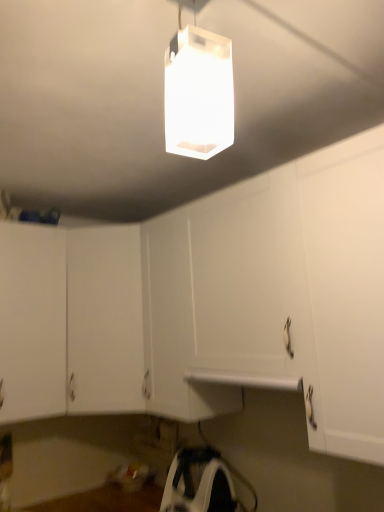
What do you see at coordinates (201, 483) in the screenshot? I see `white plastic iron at lower center` at bounding box center [201, 483].

What is the approximate width of white matte cabinet at lower left, the 2th cabinetry positioned from the right?

white matte cabinet at lower left, the 2th cabinetry positioned from the right, is 15.60 inches in width.

In order to face transparent plastic lamp at upper center, should I rotate leftwards or rightwards?

Rotate your view right by about 0.260°.

Describe the element at coordinates (198, 91) in the screenshot. I see `transparent plastic lamp at upper center` at that location.

This screenshot has width=384, height=512. What are the coordinates of `white plastic iron at lower center` in the screenshot? It's located at (201, 483).

How distant is white matte cabinet at center, which appears as the second cabinetry when viewed from the left, from white plastic iron at lower center?

A distance of 23.90 inches exists between white matte cabinet at center, which appears as the second cabinetry when viewed from the left, and white plastic iron at lower center.

Is white matte cabinet at center, which is the 1th cabinetry from right to left, not near white plastic iron at lower center?

No, white matte cabinet at center, which is the 1th cabinetry from right to left, is in close proximity to white plastic iron at lower center.

Can you confirm if white matte cabinet at center, which is the 1th cabinetry from right to left, is positioned to the right of white plastic iron at lower center?

Incorrect, white matte cabinet at center, which is the 1th cabinetry from right to left, is not on the right side of white plastic iron at lower center.

Does white matte cabinet at center, which appears as the second cabinetry when viewed from the left, have a greater width compared to white plastic iron at lower center?

Correct, the width of white matte cabinet at center, which appears as the second cabinetry when viewed from the left, exceeds that of white plastic iron at lower center.

Can you confirm if white matte cabinet at lower left, the 2th cabinetry positioned from the right, is shorter than white plastic iron at lower center?

In fact, white matte cabinet at lower left, the 2th cabinetry positioned from the right, may be taller than white plastic iron at lower center.

From the image's perspective, between white matte cabinet at lower left, the 1th cabinetry viewed from the left, and white plastic iron at lower center, who is located below?

white plastic iron at lower center appears lower in the image.

Which object is wider, white matte cabinet at lower left, the 1th cabinetry viewed from the left, or white plastic iron at lower center?

white matte cabinet at lower left, the 1th cabinetry viewed from the left.

Does white matte cabinet at lower left, the 1th cabinetry viewed from the left, turn towards white plastic iron at lower center?

No, white matte cabinet at lower left, the 1th cabinetry viewed from the left, is not turned towards white plastic iron at lower center.

From the image's perspective, which object appears higher, white matte cabinet at lower left, the 2th cabinetry positioned from the right, or white matte cabinet at center, which appears as the second cabinetry when viewed from the left?

white matte cabinet at lower left, the 2th cabinetry positioned from the right, from the image's perspective.

Considering the sizes of white matte cabinet at lower left, the 1th cabinetry viewed from the left, and white matte cabinet at center, which appears as the second cabinetry when viewed from the left, in the image, is white matte cabinet at lower left, the 1th cabinetry viewed from the left, bigger or smaller than white matte cabinet at center, which appears as the second cabinetry when viewed from the left,?

Clearly, white matte cabinet at lower left, the 1th cabinetry viewed from the left, is smaller in size than white matte cabinet at center, which appears as the second cabinetry when viewed from the left.

You are a GUI agent. You are given a task and a screenshot of the screen. Output one action in this format:
    pyautogui.click(x=<x>, y=<y>)
    Task: Click on the cabinetry on the left of white matte cabinet at center, which appears as the second cabinetry when viewed from the left
    The image size is (384, 512).
    Given the screenshot: What is the action you would take?
    pyautogui.click(x=32, y=322)

From a real-world perspective, is white matte cabinet at lower left, the 2th cabinetry positioned from the right, below white matte cabinet at center, which is the 1th cabinetry from right to left?

Actually, white matte cabinet at lower left, the 2th cabinetry positioned from the right, is physically above white matte cabinet at center, which is the 1th cabinetry from right to left, in the real world.

From a real-world perspective, which object stands above the other?

transparent plastic lamp at upper center, from a real-world perspective.

Considering the positions of objects transparent plastic lamp at upper center and white matte cabinet at center, which appears as the second cabinetry when viewed from the left, in the image provided, who is behind, transparent plastic lamp at upper center or white matte cabinet at center, which appears as the second cabinetry when viewed from the left,?

Positioned behind is white matte cabinet at center, which appears as the second cabinetry when viewed from the left.

Considering the relative sizes of transparent plastic lamp at upper center and white matte cabinet at center, which is the 1th cabinetry from right to left, in the image provided, is transparent plastic lamp at upper center shorter than white matte cabinet at center, which is the 1th cabinetry from right to left,?

Yes, transparent plastic lamp at upper center is shorter than white matte cabinet at center, which is the 1th cabinetry from right to left.

Is transparent plastic lamp at upper center with white matte cabinet at center, which is the 1th cabinetry from right to left?

They are not placed beside each other.

From a real-world perspective, who is located lower, white matte cabinet at center, which appears as the second cabinetry when viewed from the left, or white matte cabinet at lower left, the 2th cabinetry positioned from the right?

white matte cabinet at center, which appears as the second cabinetry when viewed from the left, is physically lower.

Is white matte cabinet at center, which is the 1th cabinetry from right to left, facing towards white matte cabinet at lower left, the 2th cabinetry positioned from the right?

No, white matte cabinet at center, which is the 1th cabinetry from right to left, is not turned towards white matte cabinet at lower left, the 2th cabinetry positioned from the right.

Between white matte cabinet at center, which is the 1th cabinetry from right to left, and white matte cabinet at lower left, the 1th cabinetry viewed from the left, which one appears on the left side from the viewer's perspective?

white matte cabinet at lower left, the 1th cabinetry viewed from the left.

Is white plastic iron at lower center positioned beyond the bounds of white matte cabinet at center, which is the 1th cabinetry from right to left?

Indeed, white plastic iron at lower center is completely outside white matte cabinet at center, which is the 1th cabinetry from right to left.

From a real-world perspective, is white plastic iron at lower center located beneath white matte cabinet at center, which is the 1th cabinetry from right to left?

Correct, in the physical world, white plastic iron at lower center is lower than white matte cabinet at center, which is the 1th cabinetry from right to left.

Based on the photo, how far apart are white plastic iron at lower center and white matte cabinet at center, which is the 1th cabinetry from right to left?

23.90 inches.

Can you tell me how much white plastic iron at lower center and white matte cabinet at center, which is the 1th cabinetry from right to left, differ in facing direction?

49.9 degrees.

From a real-world perspective, is white matte cabinet at center, which is the 1th cabinetry from right to left, on top of transparent plastic lamp at upper center?

No, from a real-world perspective, white matte cabinet at center, which is the 1th cabinetry from right to left, is not over transparent plastic lamp at upper center

From the image's perspective, is white matte cabinet at center, which is the 1th cabinetry from right to left, beneath transparent plastic lamp at upper center?

Correct, white matte cabinet at center, which is the 1th cabinetry from right to left, appears lower than transparent plastic lamp at upper center in the image.

Could you tell me if white matte cabinet at center, which appears as the second cabinetry when viewed from the left, is turned towards transparent plastic lamp at upper center?

No, white matte cabinet at center, which appears as the second cabinetry when viewed from the left, is not oriented towards transparent plastic lamp at upper center.

Which cabinetry is the 1st one when counting from the left side of the white plastic iron at lower center? Please provide its 2D coordinates.

[(104, 321)]

The width and height of the screenshot is (384, 512). Find the location of `appliance lying below the white matte cabinet at lower left, the 2th cabinetry positioned from the right (from the image's perspective)`. appliance lying below the white matte cabinet at lower left, the 2th cabinetry positioned from the right (from the image's perspective) is located at coordinates (201, 483).

Looking at the image, which one is located closer to white matte cabinet at lower left, the 1th cabinetry viewed from the left, white plastic iron at lower center or transparent plastic lamp at upper center?

white plastic iron at lower center.

Looking at the image, which one is located closer to white matte cabinet at lower left, the 1th cabinetry viewed from the left, white plastic iron at lower center or white matte cabinet at center, which appears as the second cabinetry when viewed from the left?

white matte cabinet at center, which appears as the second cabinetry when viewed from the left.

Looking at the image, which one is located further to transparent plastic lamp at upper center, white plastic iron at lower center or white matte cabinet at center, which is the 1th cabinetry from right to left?

white plastic iron at lower center is positioned further to the anchor transparent plastic lamp at upper center.

Estimate the real-world distances between objects in this image. Which object is further from transparent plastic lamp at upper center, white matte cabinet at center, which is the 1th cabinetry from right to left, or white matte cabinet at lower left, the 1th cabinetry viewed from the left?

white matte cabinet at lower left, the 1th cabinetry viewed from the left.

Which object lies nearer to the anchor point white plastic iron at lower center, white matte cabinet at lower left, the 2th cabinetry positioned from the right, or white matte cabinet at center, which appears as the second cabinetry when viewed from the left?

Among the two, white matte cabinet at center, which appears as the second cabinetry when viewed from the left, is located nearer to white plastic iron at lower center.

From the image, which object appears to be farther from white matte cabinet at center, which is the 1th cabinetry from right to left, transparent plastic lamp at upper center or white matte cabinet at lower left, the 1th cabinetry viewed from the left?

The object further to white matte cabinet at center, which is the 1th cabinetry from right to left, is transparent plastic lamp at upper center.

From the picture: When comparing their distances from white matte cabinet at center, which is the 1th cabinetry from right to left, does white matte cabinet at lower left, the 1th cabinetry viewed from the left, or transparent plastic lamp at upper center seem closer?

Based on the image, white matte cabinet at lower left, the 1th cabinetry viewed from the left, appears to be nearer to white matte cabinet at center, which is the 1th cabinetry from right to left.

When comparing their distances from white plastic iron at lower center, does white matte cabinet at center, which is the 1th cabinetry from right to left, or transparent plastic lamp at upper center seem further?

Among the two, transparent plastic lamp at upper center is located further to white plastic iron at lower center.

Image resolution: width=384 pixels, height=512 pixels. I want to click on cabinetry between white matte cabinet at lower left, the 1th cabinetry viewed from the left, and white plastic iron at lower center, so click(104, 321).

I want to click on cabinetry between transparent plastic lamp at upper center and white matte cabinet at center, which is the 1th cabinetry from right to left, in the front-back direction, so click(x=32, y=322).